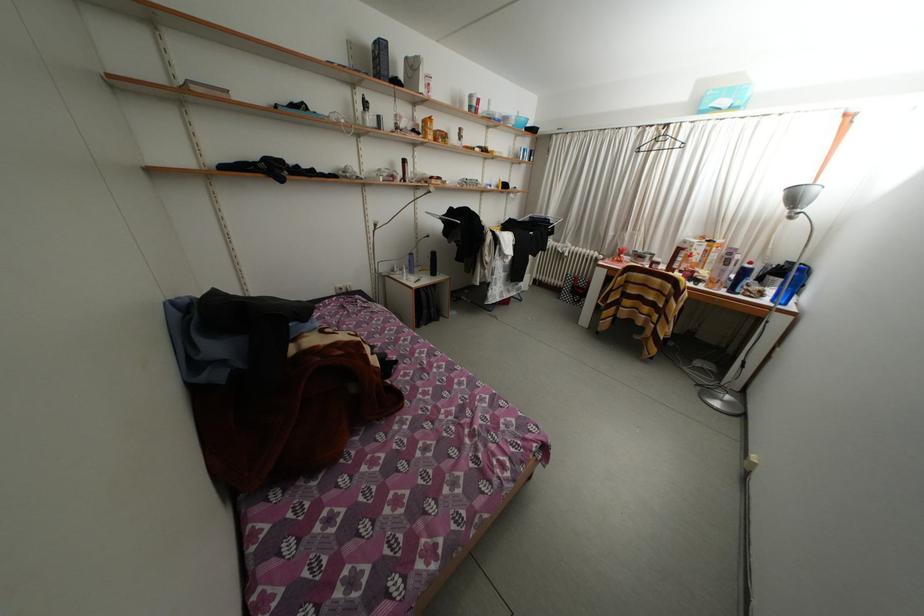
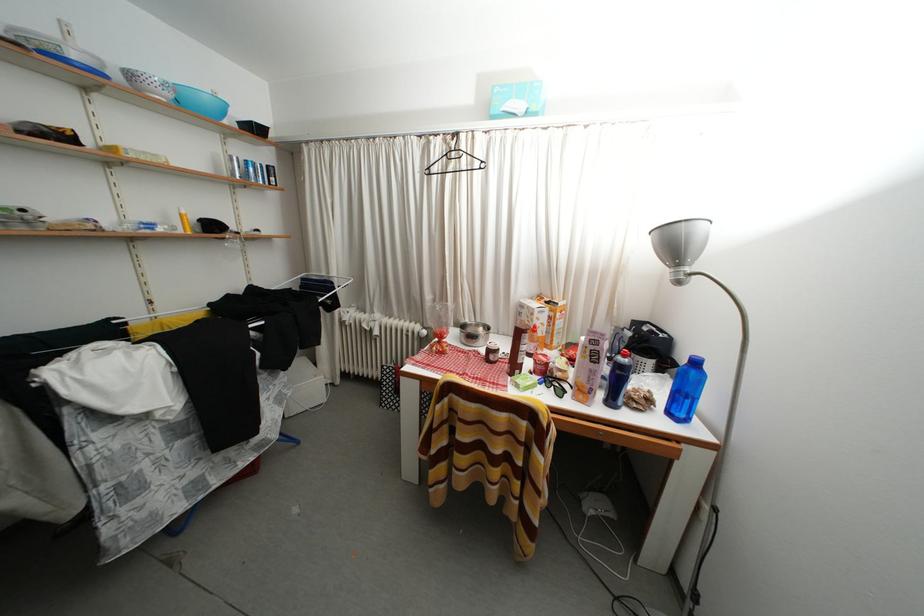
In the second image, find the point that corresponds to the point at 664,152 in the first image.

(458, 172)